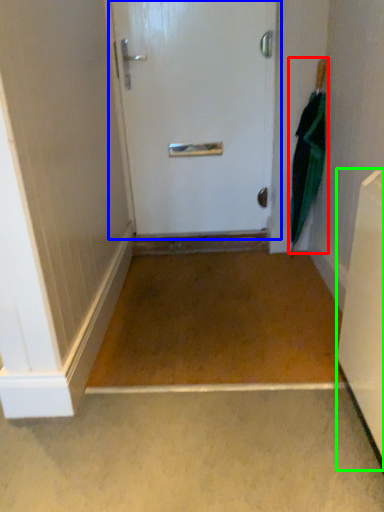
Question: Which object is positioned farthest from umbrella (highlighted by a red box)? Select from door (highlighted by a blue box) and appliance (highlighted by a green box).

Choices:
 (A) door
 (B) appliance

Answer: (B)